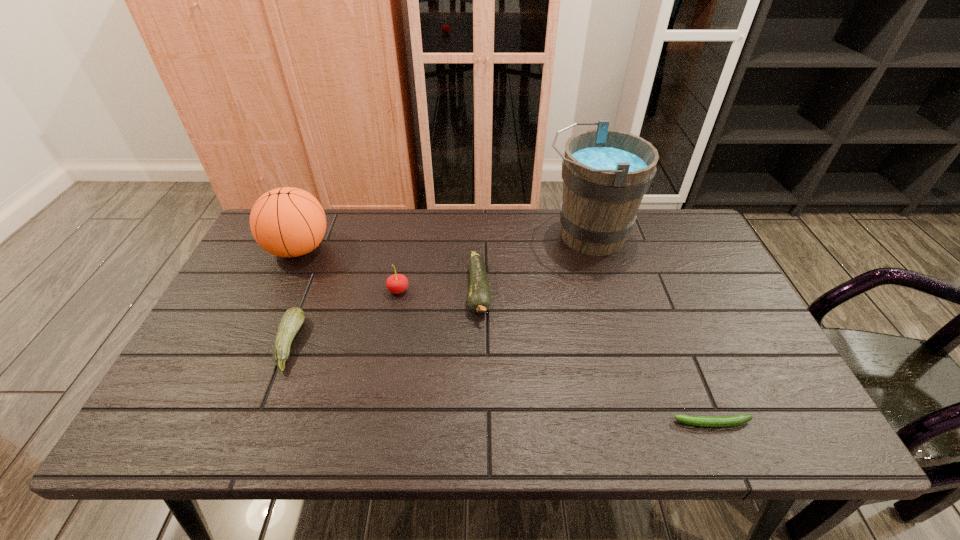
Locate an element on the screen. wine bucket that is at the far edge is located at coordinates (605, 173).

I want to click on basketball located in the far edge section of the desktop, so click(x=287, y=222).

Identify the location of object positioned at the near edge. (x=705, y=421).

Image resolution: width=960 pixels, height=540 pixels. In order to click on object positioned at the left edge in this screenshot , I will do `click(287, 222)`.

The width and height of the screenshot is (960, 540). Identify the location of object that is at the right edge. (705, 421).

The image size is (960, 540). Find the location of `object that is at the far left corner`. object that is at the far left corner is located at coordinates (287, 222).

At what (x,y) coordinates should I click in order to perform the action: click on object that is at the near right corner. Please return your answer as a coordinate pair (x, y). Looking at the image, I should click on (705, 421).

Find the location of a particular element. This screenshot has height=540, width=960. vacant area at the far edge is located at coordinates (343, 215).

This screenshot has height=540, width=960. Find the location of `vacant space at the near edge`. vacant space at the near edge is located at coordinates (318, 422).

Find the location of a particular element. The image size is (960, 540). blank space at the right edge of the desktop is located at coordinates (693, 274).